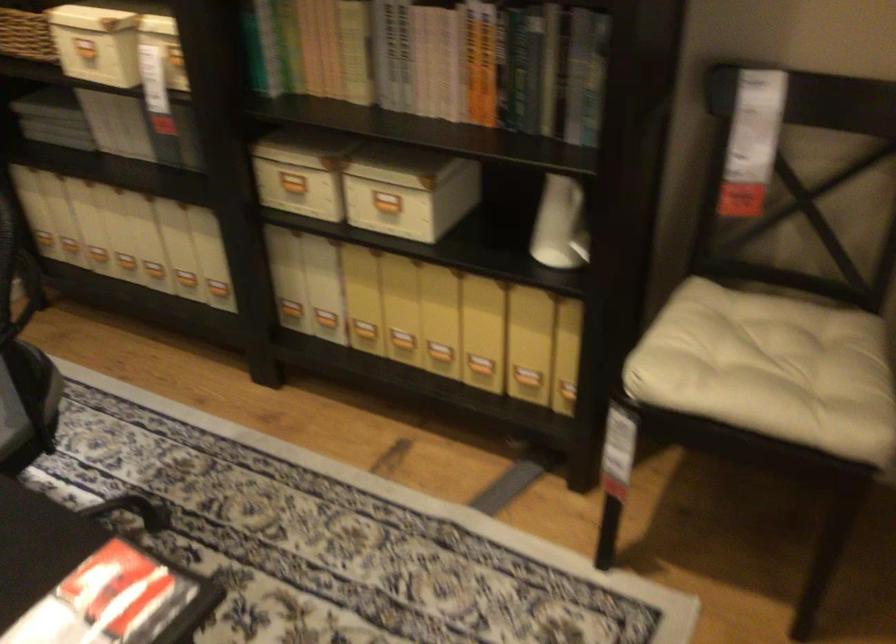
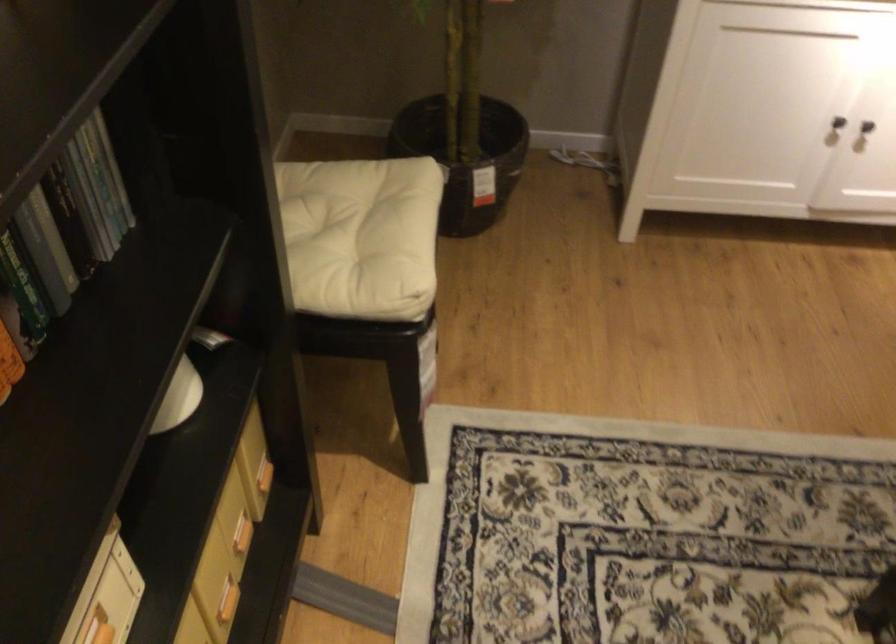
Question: I am providing you with two images of the same scene from different viewpoints. After the viewpoint changes to image2, which objects are now occluded?

Choices:
 (A) chair sitting surface
 (B) yellow box handle
 (C) book
 (D) none of these

Answer: (D)